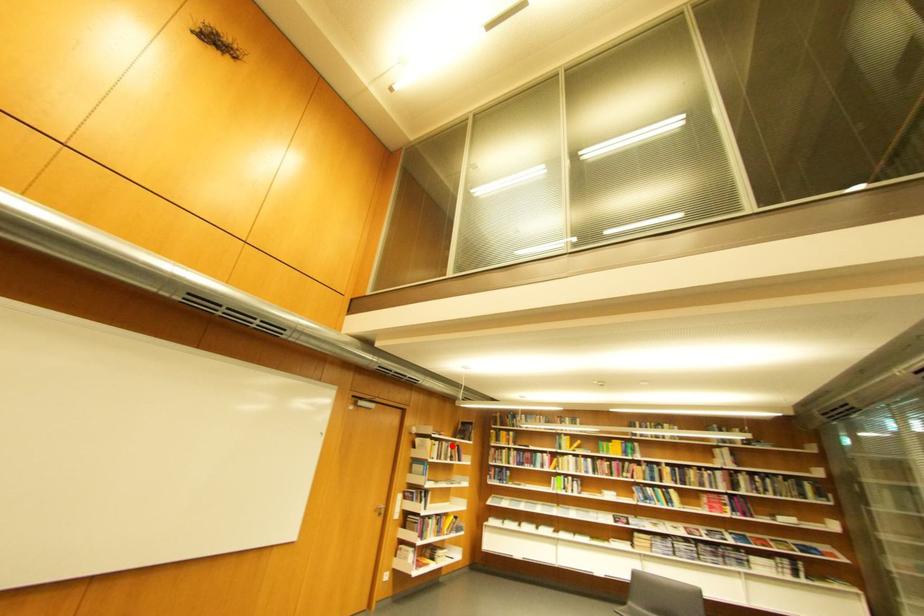
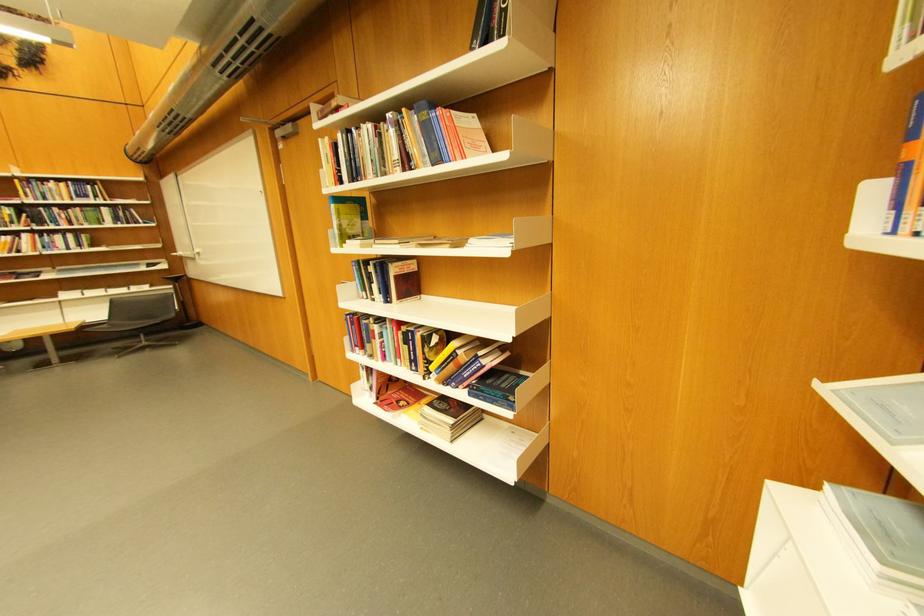
In the second image, find the point that corresponds to the highlighted location in the first image.

(370, 137)